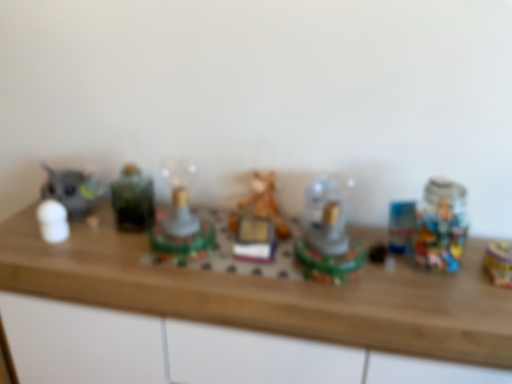
Find the location of a particular element. The height and width of the screenshot is (384, 512). free point to the right of white matte figurine at left, the first toy positioned from the left is located at coordinates (104, 246).